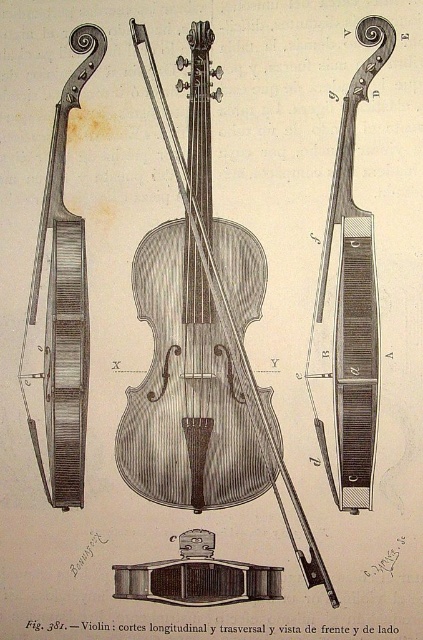
You are examining the violin illustration and want to determine the spatial relationship between two points marked in the image. Which point, point (197, 419) or point (44, 483), is closer to you?

Point (197, 419) is further to the viewer than point (44, 483), so point (44, 483) is closer to you.

From the picture: You are an instrument maker who needs to place both the wooden violin at center and the wooden violin at right on a 12 inch wide shelf. Can both violins fit side by side on the shelf without overlapping?

The wooden violin at center is 9.71 inches from the wooden violin at right, so the total width required would be the sum of their individual widths plus the 9.71 inches between them. However, since the shelf is only 12 inches wide, it is unclear if they can fit without knowing the actual widths of the violins themselves. The given distance between them is 9.71 inches, but without knowing each violin s individual size, we cannot determine if they will fit within the 12 inch shelf.

You are a music teacher explaining the violin to a student. You have two violins in front of you, the wooden violin at right and the matte wood violin at left. Which one is narrower in width?

The wooden violin at right has a lesser width compared to the matte wood violin at left, so the wooden violin at right is narrower in width.